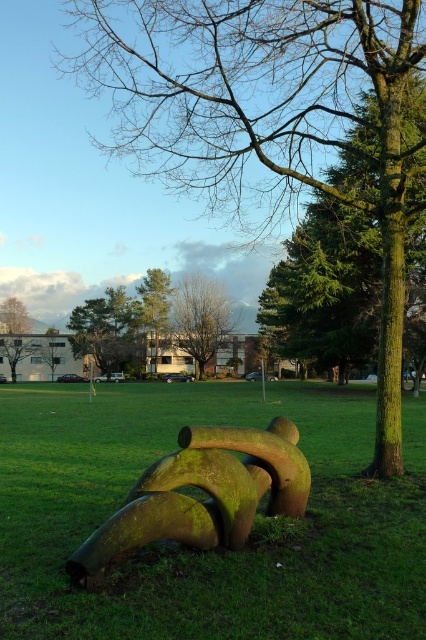
How distant is green mossy pipes at center from green textured tree at upper center?

They are 38.58 meters apart.

Does green mossy pipes at center appear on the right side of green textured tree at upper center?

Indeed, green mossy pipes at center is positioned on the right side of green textured tree at upper center.

Between point (411, 435) and point (149, 296), which one is positioned behind?

Positioned behind is point (149, 296).

Where is `green mossy pipes at center`? The image size is (426, 640). green mossy pipes at center is located at coordinates (215, 550).

Is green mossy pipes at center smaller than green textured tree at center?

Incorrect, green mossy pipes at center is not smaller in size than green textured tree at center.

Does green mossy pipes at center appear under green textured tree at center?

A: Correct, green mossy pipes at center is located below green textured tree at center.

Locate an element on the screen. The image size is (426, 640). green mossy pipes at center is located at coordinates (215, 550).

You are a GUI agent. You are given a task and a screenshot of the screen. Output one action in this format:
    pyautogui.click(x=<x>, y=<y>)
    Task: Click on the green mossy pipes at center
    This screenshot has height=640, width=426.
    Given the screenshot: What is the action you would take?
    pyautogui.click(x=215, y=550)

Is green textured tree at center closer to the viewer compared to green mossy pipe at center?

No.

Which is above, green textured tree at center or green mossy pipe at center?

green textured tree at center is higher up.

The height and width of the screenshot is (640, 426). I want to click on green textured tree at center, so click(267, 116).